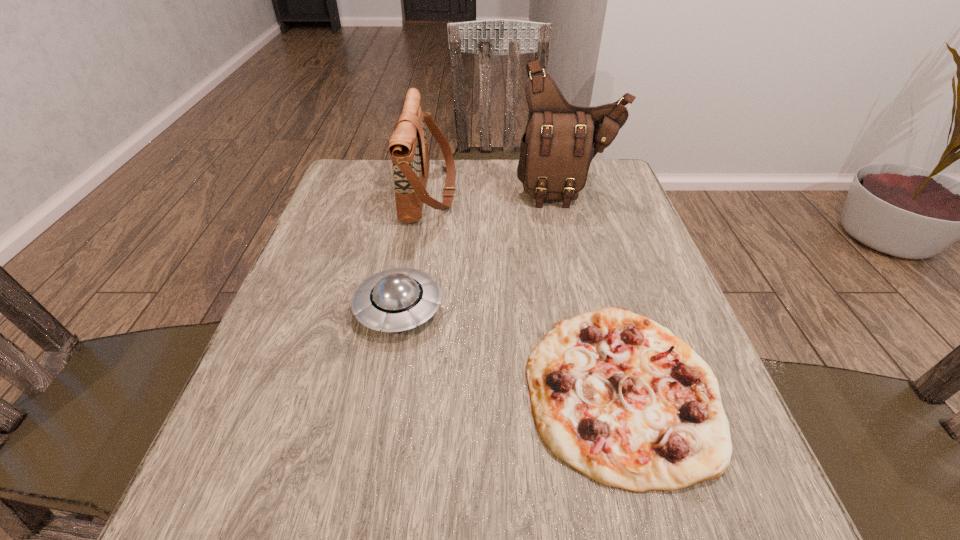
The height and width of the screenshot is (540, 960). In order to click on the taller shoulder bag in this screenshot , I will do `click(560, 140)`.

The width and height of the screenshot is (960, 540). In order to click on the right shoulder bag in this screenshot , I will do `click(560, 140)`.

You are a GUI agent. You are given a task and a screenshot of the screen. Output one action in this format:
    pyautogui.click(x=<x>, y=<y>)
    Task: Click on the shorter shoulder bag
    The height and width of the screenshot is (540, 960).
    Given the screenshot: What is the action you would take?
    (x=408, y=147)

This screenshot has height=540, width=960. I want to click on the third shortest object, so click(408, 147).

The width and height of the screenshot is (960, 540). I want to click on the second shortest object, so click(394, 300).

Identify the location of pizza. Image resolution: width=960 pixels, height=540 pixels. (618, 397).

The image size is (960, 540). Find the location of `vacant space located 0.130m on the front-facing side of the tallest object`. vacant space located 0.130m on the front-facing side of the tallest object is located at coordinates (581, 241).

You are a GUI agent. You are given a task and a screenshot of the screen. Output one action in this format:
    pyautogui.click(x=<x>, y=<y>)
    Task: Click on the vacant space located on the front-facing side of the shorter shoulder bag
    The width and height of the screenshot is (960, 540).
    Given the screenshot: What is the action you would take?
    pyautogui.click(x=591, y=192)

This screenshot has width=960, height=540. Identify the location of free region located 0.190m on the front of the saucer. (374, 442).

Locate an element on the screen. This screenshot has width=960, height=540. vacant space located on the back of the shortest object is located at coordinates (572, 204).